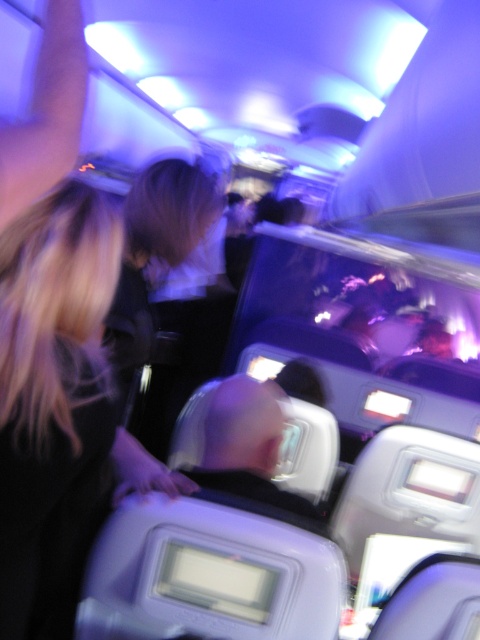
You are a flight attendant checking the cabin. You notice a passenger with blonde hair at left and another passenger with a smooth skin head at center. Which passenger has a feature that is taller?

The blonde hair at left is taller than the smooth skin head at center.

You are a passenger sitting in the airplane cabin and want to reach a point marked at coordinates point (70,628). If your arm can extend up to 4 feet, can you reach it?

The point (70,628) is 3.84 feet away from the camera, so yes, you can reach it since your arm can extend up to 4 feet.